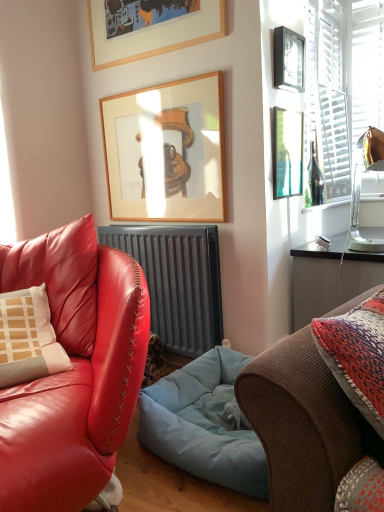
Question: Is wooden picture frame at upper center, which appears as the third picture frame when viewed from the top, not inside matte black picture frame at upper right, the third picture frame ordered from the bottom?

Choices:
 (A) yes
 (B) no

Answer: (A)

Question: Can you confirm if wooden picture frame at upper center, arranged as the 2th picture frame when ordered from the bottom, is bigger than matte black picture frame at upper right, the second picture frame in the top-to-bottom sequence?

Choices:
 (A) no
 (B) yes

Answer: (B)

Question: Is wooden picture frame at upper center, which appears as the third picture frame when viewed from the top, aimed at matte black picture frame at upper right, the third picture frame ordered from the bottom?

Choices:
 (A) yes
 (B) no

Answer: (B)

Question: From the image's perspective, does wooden picture frame at upper center, which appears as the third picture frame when viewed from the top, appear lower than matte black picture frame at upper right, the second picture frame in the top-to-bottom sequence?

Choices:
 (A) no
 (B) yes

Answer: (B)

Question: Can you confirm if wooden picture frame at upper center, which appears as the third picture frame when viewed from the top, is thinner than matte black picture frame at upper right, the third picture frame ordered from the bottom?

Choices:
 (A) yes
 (B) no

Answer: (A)

Question: Is matte black picture frame at upper right, the second picture frame in the top-to-bottom sequence, in front of or behind matte leather couch at center, placed as the second studio couch when sorted from right to left, in the image?

Choices:
 (A) behind
 (B) front

Answer: (A)

Question: Considering the positions of matte black picture frame at upper right, the second picture frame in the top-to-bottom sequence, and matte leather couch at center, placed as the second studio couch when sorted from right to left, in the image, is matte black picture frame at upper right, the second picture frame in the top-to-bottom sequence, bigger or smaller than matte leather couch at center, placed as the second studio couch when sorted from right to left,?

Choices:
 (A) big
 (B) small

Answer: (B)

Question: Is point (x=279, y=31) positioned closer to the camera than point (x=3, y=481)?

Choices:
 (A) farther
 (B) closer

Answer: (A)

Question: Is matte black picture frame at upper right, the third picture frame ordered from the bottom, inside or outside of matte leather couch at center, placed as the second studio couch when sorted from right to left?

Choices:
 (A) inside
 (B) outside

Answer: (B)

Question: Looking at the image, does wooden picture frame at upper center, which appears as the third picture frame when viewed from the top, seem bigger or smaller compared to green glass bottle at upper right, the fourth picture frame from the top?

Choices:
 (A) big
 (B) small

Answer: (A)

Question: Considering the positions of wooden picture frame at upper center, arranged as the 2th picture frame when ordered from the bottom, and green glass bottle at upper right, the fourth picture frame from the top, in the image, is wooden picture frame at upper center, arranged as the 2th picture frame when ordered from the bottom, wider or thinner than green glass bottle at upper right, the fourth picture frame from the top,?

Choices:
 (A) wide
 (B) thin

Answer: (A)

Question: Relative to green glass bottle at upper right, the fourth picture frame from the top, is wooden picture frame at upper center, arranged as the 2th picture frame when ordered from the bottom, in front or behind?

Choices:
 (A) behind
 (B) front

Answer: (A)

Question: Is wooden picture frame at upper center, which appears as the third picture frame when viewed from the top, taller or shorter than green glass bottle at upper right, the fourth picture frame from the top?

Choices:
 (A) short
 (B) tall

Answer: (B)

Question: Is green glass bottle at upper right wider or thinner than wooden picture frame at upper center, arranged as the 2th picture frame when ordered from the bottom?

Choices:
 (A) thin
 (B) wide

Answer: (B)

Question: Do you think green glass bottle at upper right is within wooden picture frame at upper center, arranged as the 2th picture frame when ordered from the bottom, or outside of it?

Choices:
 (A) outside
 (B) inside

Answer: (A)